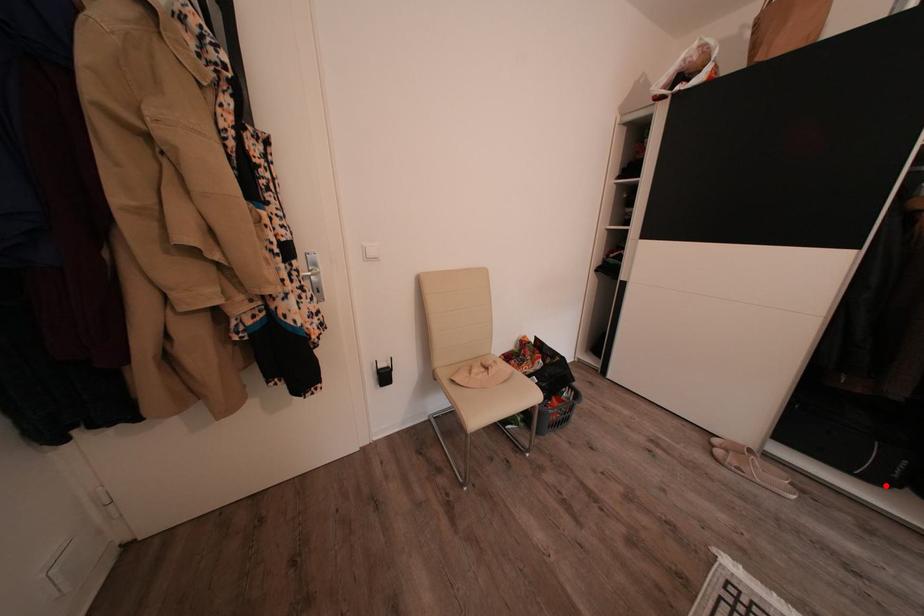
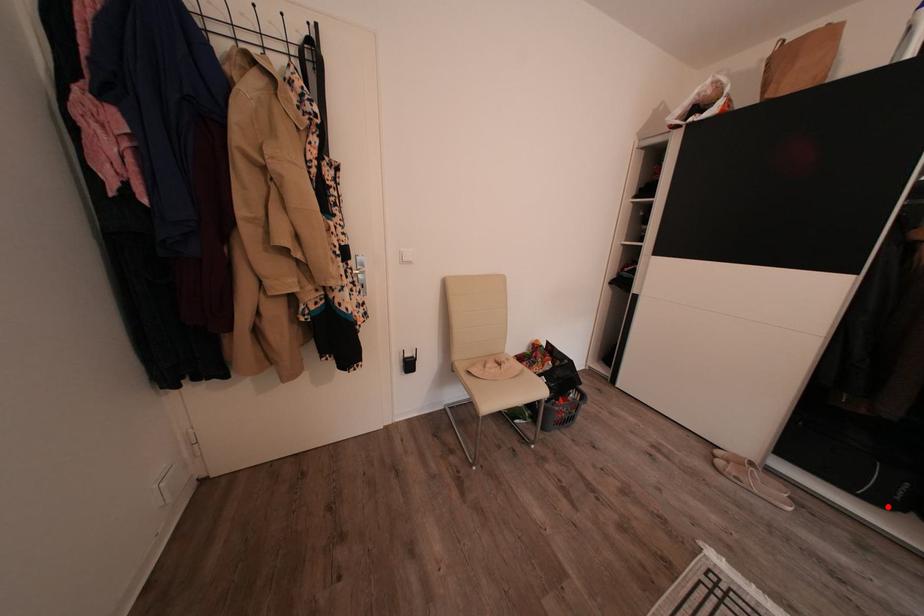
I am providing you with two images of the same scene from different viewpoints. A red point is marked on the first image and another point is marked on the second image. Is the red point in image1 aligned with the point shown in image2?

Yes